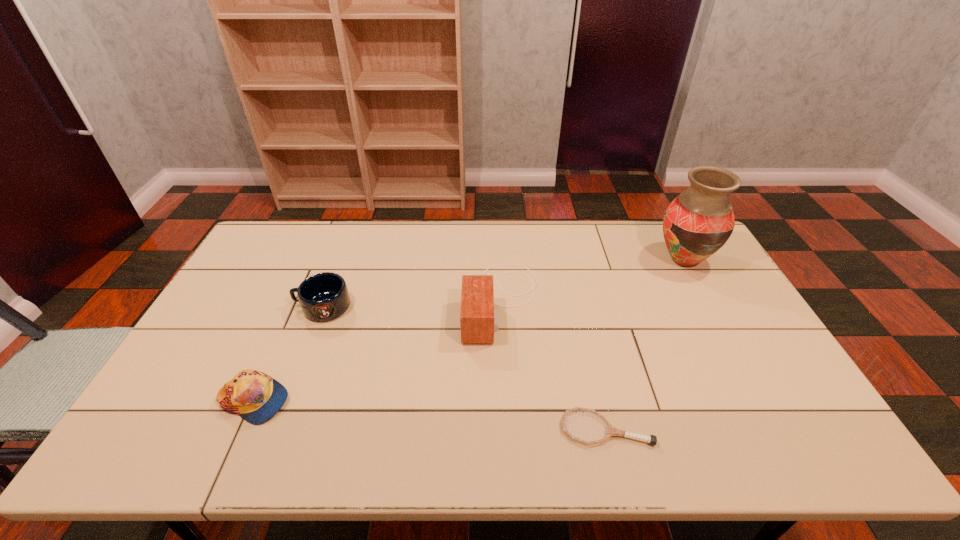
The image size is (960, 540). In order to click on the tallest object in this screenshot , I will do pyautogui.click(x=697, y=223).

The height and width of the screenshot is (540, 960). In order to click on vase in this screenshot , I will do `click(697, 223)`.

Where is `the fourth shortest object`? Image resolution: width=960 pixels, height=540 pixels. the fourth shortest object is located at coordinates (478, 321).

You are a GUI agent. You are given a task and a screenshot of the screen. Output one action in this format:
    pyautogui.click(x=<x>, y=<y>)
    Task: Click on the third object from right to left
    
    Given the screenshot: What is the action you would take?
    pyautogui.click(x=478, y=321)

Identify the location of mug. (324, 296).

Identify the location of cap. Image resolution: width=960 pixels, height=540 pixels. (256, 397).

Locate an element on the screen. This screenshot has height=540, width=960. the shortest object is located at coordinates (611, 431).

I want to click on tennis racket, so click(x=611, y=431).

This screenshot has width=960, height=540. I want to click on vacant region located 0.310m on the left of the vase, so click(564, 260).

The image size is (960, 540). I want to click on vacant space located on the front-facing side of the radio receiver, so click(421, 301).